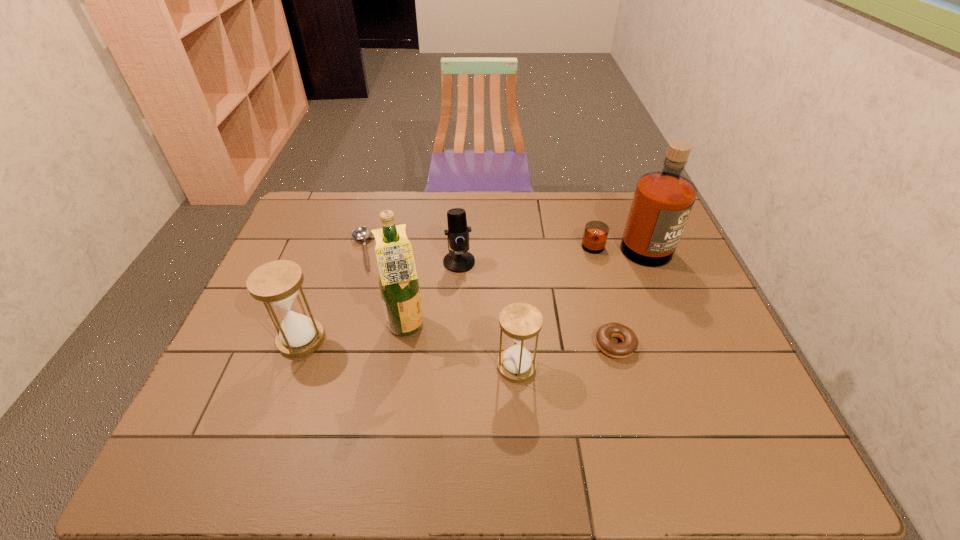
Locate an element on the screen. This screenshot has height=540, width=960. the fifth shortest object is located at coordinates (277, 283).

Locate an element on the screen. the taller hourglass is located at coordinates (277, 283).

Locate an element on the screen. The height and width of the screenshot is (540, 960). the fifth object from left to right is located at coordinates (520, 322).

Where is `the right hourglass`? Image resolution: width=960 pixels, height=540 pixels. the right hourglass is located at coordinates (520, 322).

This screenshot has height=540, width=960. I want to click on the shortest object, so click(362, 233).

The width and height of the screenshot is (960, 540). Find the location of `microphone`. microphone is located at coordinates (459, 260).

Identify the location of the farther liquor. This screenshot has height=540, width=960. (662, 202).

Locate an element on the screen. Image resolution: width=960 pixels, height=540 pixels. the nearer liquor is located at coordinates (398, 282).

Locate an element on the screen. the left liquor is located at coordinates (398, 282).

I want to click on the sixth tallest object, so click(629, 344).